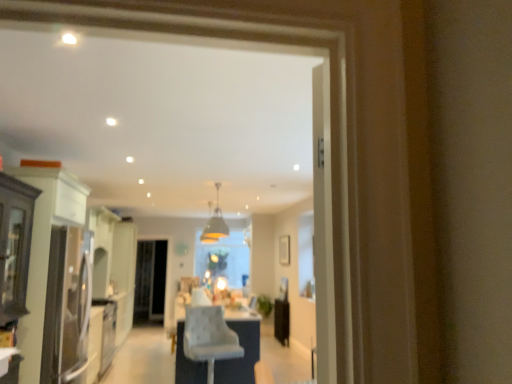
Question: From the image's perspective, would you say matte white cabinet at left is positioned over light gray fabric chair at center?

Choices:
 (A) yes
 (B) no

Answer: (A)

Question: Is matte white cabinet at left bigger than light gray fabric chair at center?

Choices:
 (A) yes
 (B) no

Answer: (A)

Question: Is light gray fabric chair at center at the back of matte white cabinet at left?

Choices:
 (A) no
 (B) yes

Answer: (A)

Question: Does matte white cabinet at left have a lesser width compared to light gray fabric chair at center?

Choices:
 (A) yes
 (B) no

Answer: (B)

Question: Can you confirm if matte white cabinet at left is wider than light gray fabric chair at center?

Choices:
 (A) yes
 (B) no

Answer: (A)

Question: Does matte white cabinet at left have a lesser height compared to light gray fabric chair at center?

Choices:
 (A) no
 (B) yes

Answer: (A)

Question: Is the depth of clear glass screen door at center greater than that of matte white cabinet at left?

Choices:
 (A) no
 (B) yes

Answer: (B)

Question: Is clear glass screen door at center positioned with its back to matte white cabinet at left?

Choices:
 (A) no
 (B) yes

Answer: (A)

Question: Can you confirm if clear glass screen door at center is thinner than matte white cabinet at left?

Choices:
 (A) no
 (B) yes

Answer: (B)

Question: Is clear glass screen door at center positioned far away from matte white cabinet at left?

Choices:
 (A) no
 (B) yes

Answer: (B)

Question: Is clear glass screen door at center to the right of matte white cabinet at left from the viewer's perspective?

Choices:
 (A) yes
 (B) no

Answer: (B)

Question: Is clear glass screen door at center completely or partially outside of matte white cabinet at left?

Choices:
 (A) yes
 (B) no

Answer: (A)

Question: Can you confirm if light gray fabric chair at center is wider than matte white cabinet at left?

Choices:
 (A) no
 (B) yes

Answer: (A)